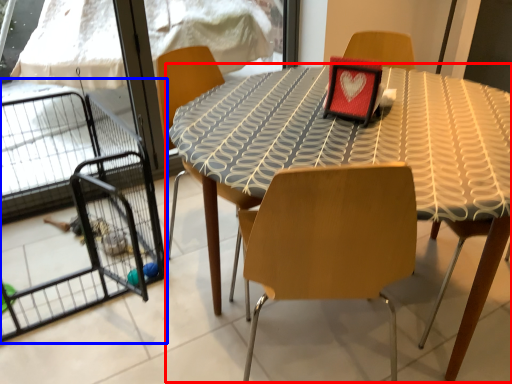
Question: Among these objects, which one is farthest to the camera, table (highlighted by a red box) or cage (highlighted by a blue box)?

Choices:
 (A) table
 (B) cage

Answer: (B)